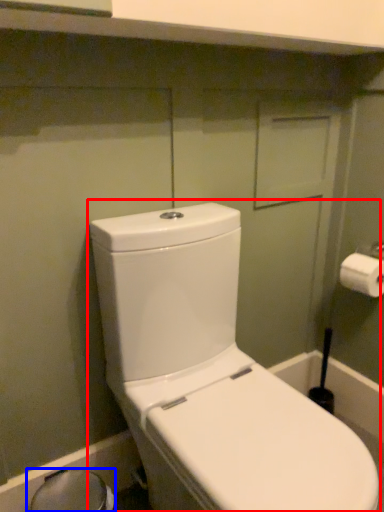
Question: Which point is closer to the camera, toilet (highlighted by a red box) or bidet (highlighted by a blue box)?

Choices:
 (A) toilet
 (B) bidet

Answer: (A)